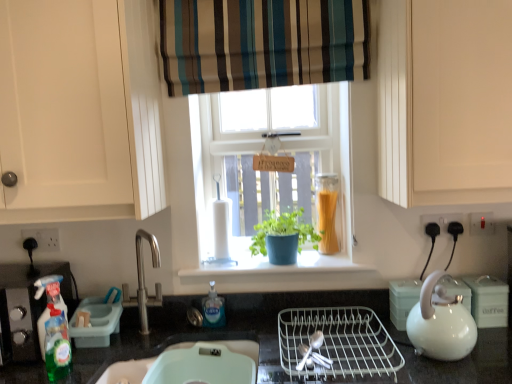
Question: Considering the relative sizes of translucent glass jar at window and white glossy teapot at right, acting as the third appliance starting from the left, in the image provided, is translucent glass jar at window taller than white glossy teapot at right, acting as the third appliance starting from the left,?

Choices:
 (A) yes
 (B) no

Answer: (A)

Question: Considering the relative sizes of translucent glass jar at window and white glossy teapot at right, the 2th appliance in the right-to-left sequence, in the image provided, is translucent glass jar at window bigger than white glossy teapot at right, the 2th appliance in the right-to-left sequence,?

Choices:
 (A) no
 (B) yes

Answer: (B)

Question: Is translucent glass jar at window aimed at white glossy teapot at right, acting as the third appliance starting from the left?

Choices:
 (A) no
 (B) yes

Answer: (A)

Question: Would you say translucent glass jar at window is a long distance from white glossy teapot at right, acting as the third appliance starting from the left?

Choices:
 (A) yes
 (B) no

Answer: (B)

Question: From the image's perspective, would you say translucent glass jar at window is shown under white glossy teapot at right, the 2th appliance in the right-to-left sequence?

Choices:
 (A) no
 (B) yes

Answer: (A)

Question: Considering the relative positions of blue textured pot at center and white glossy kettle at right in the image provided, is blue textured pot at center to the left or to the right of white glossy kettle at right?

Choices:
 (A) left
 (B) right

Answer: (A)

Question: From a real-world perspective, is blue textured pot at center above or below white glossy kettle at right?

Choices:
 (A) below
 (B) above

Answer: (B)

Question: Is blue textured pot at center spatially inside white glossy kettle at right, or outside of it?

Choices:
 (A) inside
 (B) outside

Answer: (B)

Question: Is blue textured pot at center in front of or behind white glossy kettle at right in the image?

Choices:
 (A) behind
 (B) front

Answer: (A)

Question: Does point (433, 276) appear closer or farther from the camera than point (231, 34)?

Choices:
 (A) farther
 (B) closer

Answer: (B)

Question: From the image's perspective, is white glossy kettle at right located above or below striped fabric curtain at upper center?

Choices:
 (A) below
 (B) above

Answer: (A)

Question: Looking at the image, does white glossy kettle at right seem bigger or smaller compared to striped fabric curtain at upper center?

Choices:
 (A) small
 (B) big

Answer: (A)

Question: Considering the positions of white glossy kettle at right and striped fabric curtain at upper center in the image, is white glossy kettle at right taller or shorter than striped fabric curtain at upper center?

Choices:
 (A) short
 (B) tall

Answer: (A)

Question: Is white glossy kettle at right taller or shorter than clear plastic bottle at lower center, which is counted as the 1th bottle, starting from the back?

Choices:
 (A) tall
 (B) short

Answer: (A)

Question: From a real-world perspective, relative to clear plastic bottle at lower center, the 2th bottle positioned from the front, is white glossy kettle at right vertically above or below?

Choices:
 (A) above
 (B) below

Answer: (A)